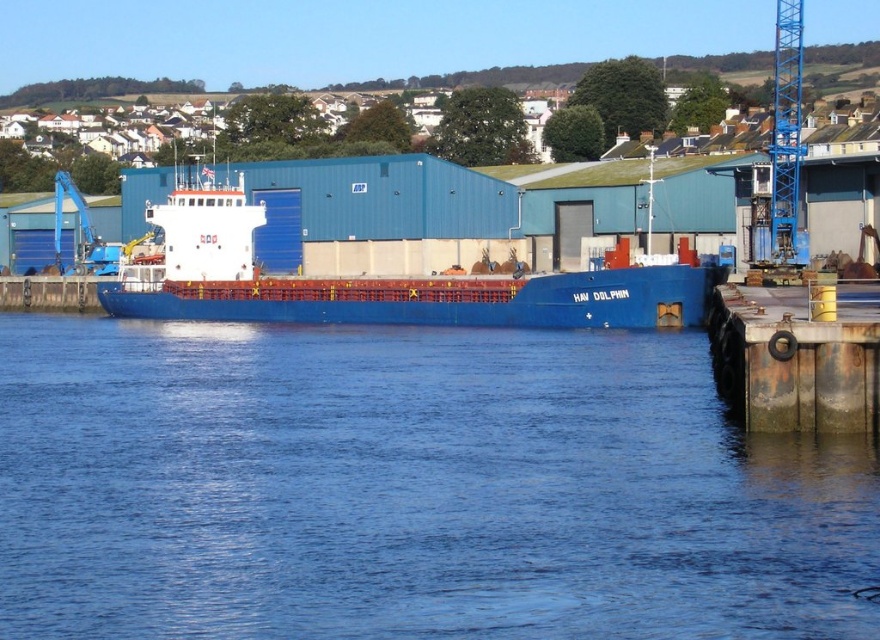
Question: Which point is closer to the camera?

Choices:
 (A) (92, 433)
 (B) (272, 298)

Answer: (A)

Question: Is blue matte cargo ship at center to the right of blue metallic crane at upper right from the viewer's perspective?

Choices:
 (A) yes
 (B) no

Answer: (B)

Question: Which point appears closest to the camera in this image?

Choices:
 (A) (207, 291)
 (B) (468, 488)

Answer: (B)

Question: Considering the real-world distances, which object is closest to the blue liquid water at center?

Choices:
 (A) rusty metal dock at lower right
 (B) blue metallic crane at upper right
 (C) blue matte cargo ship at center

Answer: (A)

Question: Considering the relative positions of blue liquid water at center and blue metallic crane at upper right in the image provided, where is blue liquid water at center located with respect to blue metallic crane at upper right?

Choices:
 (A) below
 (B) above

Answer: (A)

Question: Can you confirm if blue matte cargo ship at center is positioned below rusty metal dock at lower right?

Choices:
 (A) yes
 (B) no

Answer: (B)